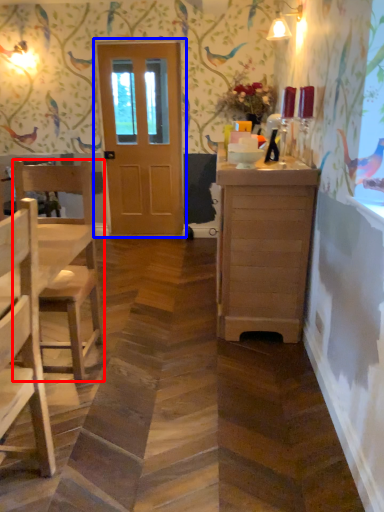
Question: Which object is closer to the camera taking this photo, chair (highlighted by a red box) or door (highlighted by a blue box)?

Choices:
 (A) chair
 (B) door

Answer: (A)